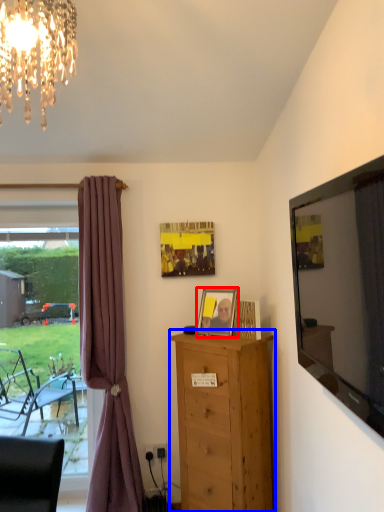
Question: Which object appears closest to the camera in this image, picture frame (highlighted by a red box) or chest of drawers (highlighted by a blue box)?

Choices:
 (A) picture frame
 (B) chest of drawers

Answer: (B)